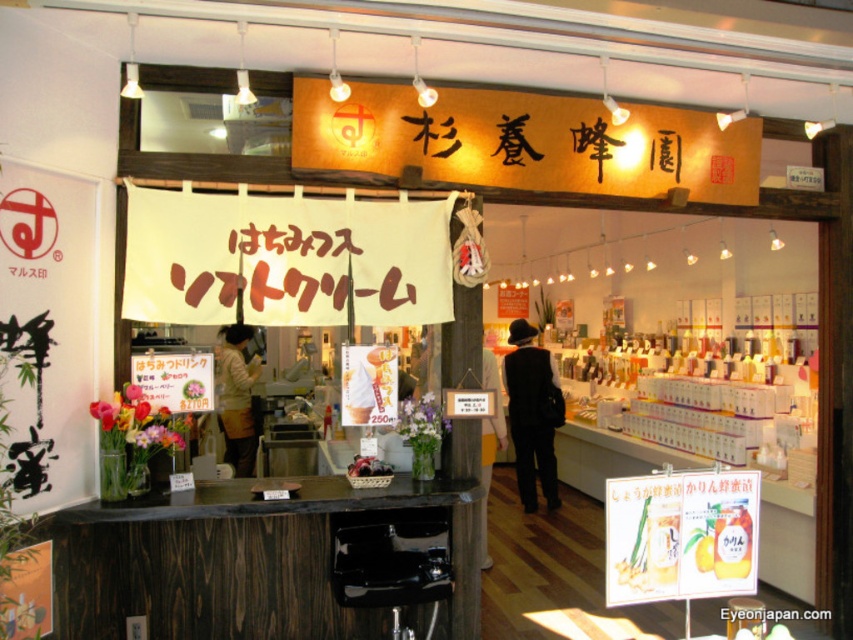
Question: Which object appears closest to the camera in this image?

Choices:
 (A) light beige fabric jacket at center
 (B) black fabric coat at center
 (C) black fabric at center

Answer: (C)

Question: Can you confirm if black fabric coat at center is bigger than black fabric at center?

Choices:
 (A) no
 (B) yes

Answer: (A)

Question: Among these points, which one is nearest to the camera?

Choices:
 (A) (489, 474)
 (B) (547, 444)
 (C) (247, 364)

Answer: (C)

Question: Does light beige fabric jacket at center have a larger size compared to black fabric at center?

Choices:
 (A) no
 (B) yes

Answer: (A)

Question: Among these points, which one is nearest to the camera?

Choices:
 (A) (519, 368)
 (B) (242, 358)

Answer: (B)

Question: Is the position of black fabric coat at center more distant than that of black fabric at center?

Choices:
 (A) yes
 (B) no

Answer: (A)